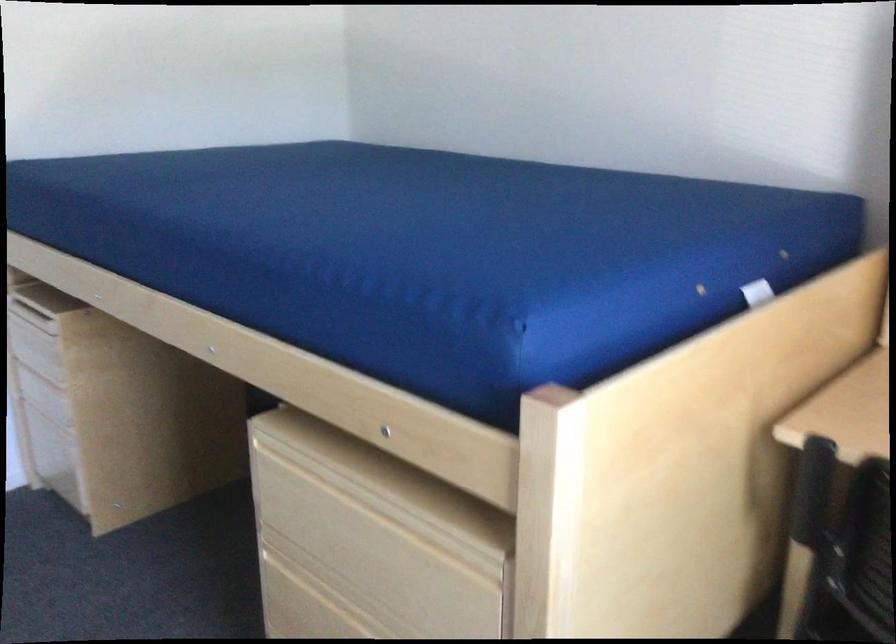
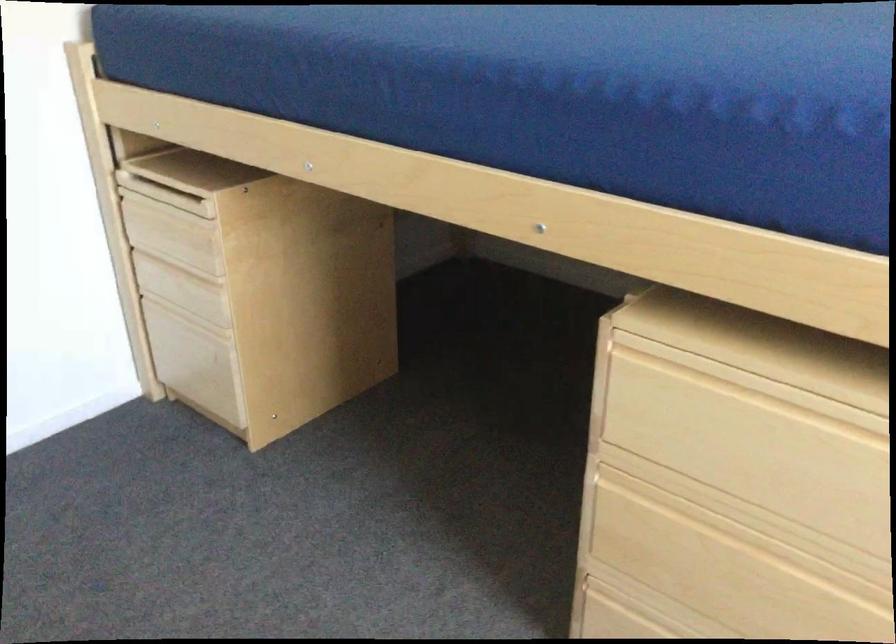
Which direction would the cameraman need to move to produce the second image?

The cameraman walked toward left, forward.